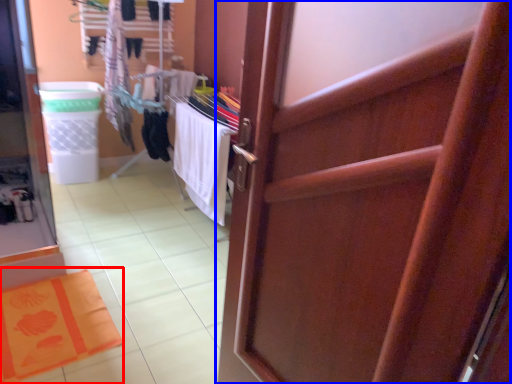
Question: Which point is closer to the camera, bath mat (highlighted by a red box) or door (highlighted by a blue box)?

Choices:
 (A) bath mat
 (B) door

Answer: (B)